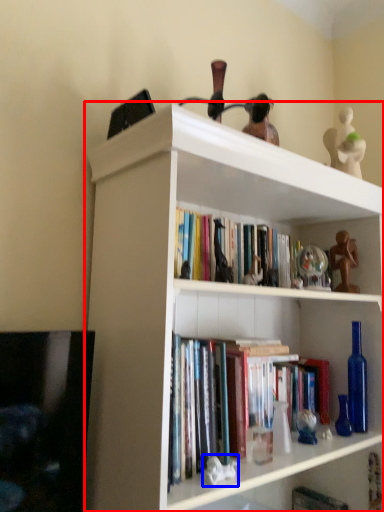
Question: Which object appears closest to the camera in this image, shelf (highlighted by a red box) or toy (highlighted by a blue box)?

Choices:
 (A) shelf
 (B) toy

Answer: (A)